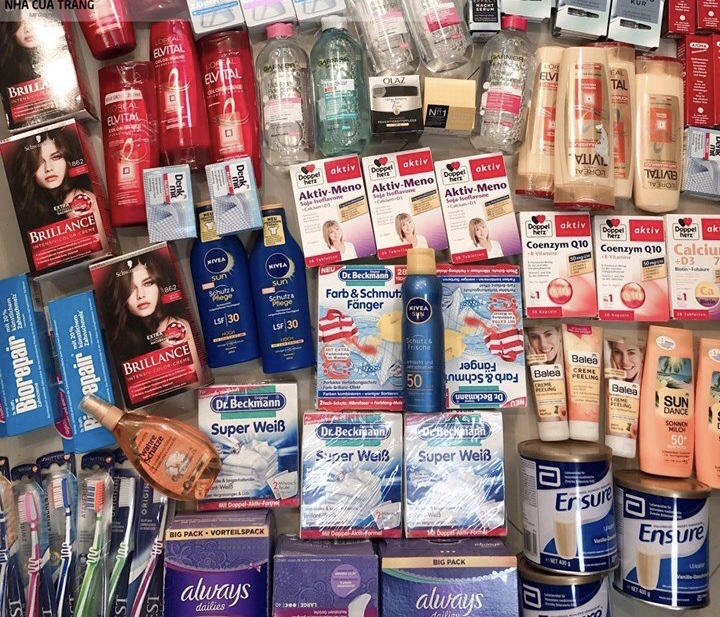
Identify the location of toothbrushes. click(x=8, y=555), click(x=32, y=526), click(x=60, y=511), click(x=91, y=503), click(x=121, y=513), click(x=160, y=518).